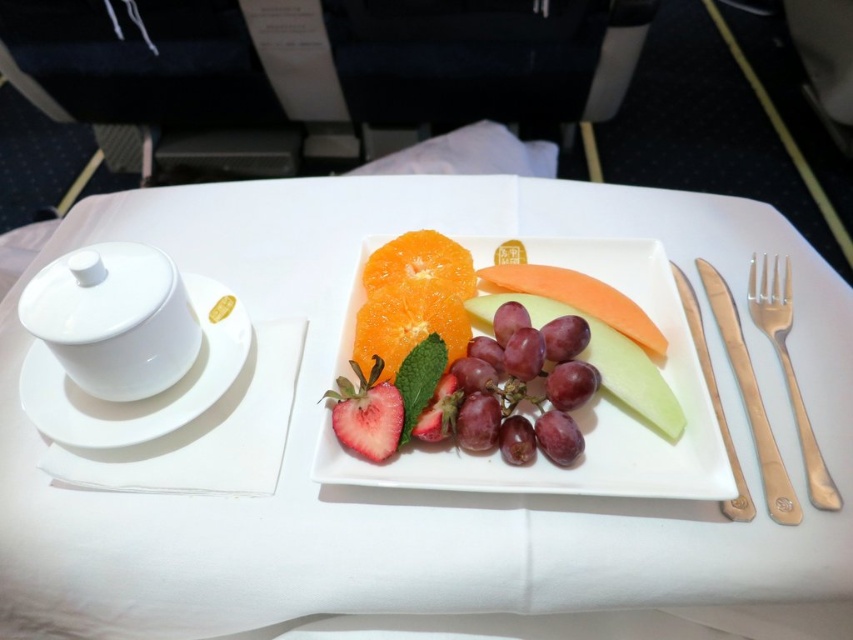
You are setting up a fruit platter and want to ensure proper placement. Given the white porcelain plate at center and the orange flesh at center, which one is positioned lower in the image?

The white porcelain plate at center is located below orange flesh at center, so the white porcelain plate at center is positioned lower.

You are a food critic standing 30 inches away from the orange matte at center on the fruit platter. Can you reach it without moving closer?

The orange matte at center is 34.34 inches away from the viewer. Since you are standing 30 inches away, you are still 4.34 inches too far to reach it without moving closer.